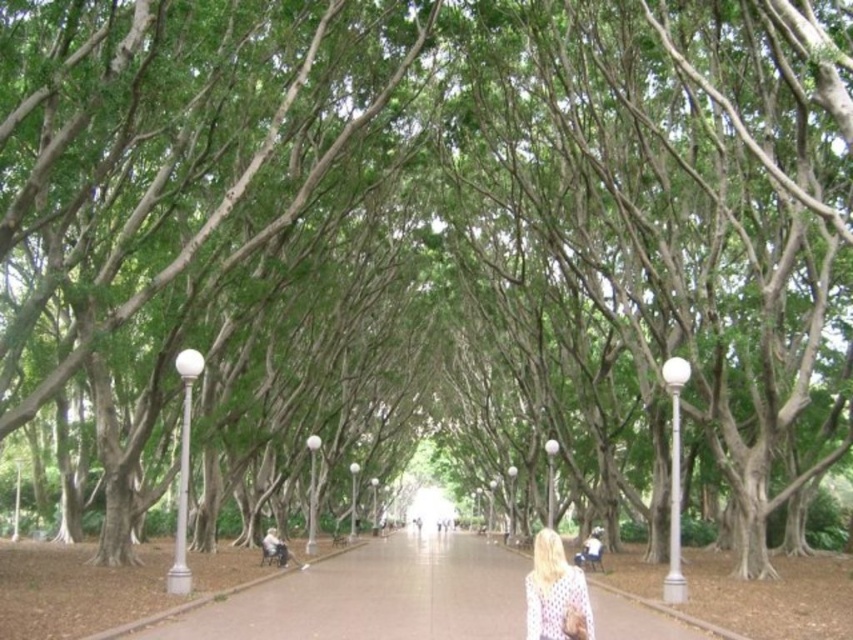
You are standing at the entrance of the pathway and want to walk to the end where the bright light is. The smooth concrete path at center is your only path. If your walking speed is 1.5 meters per second, how long will it take you to reach the end of the path?

The distance between you and the smooth concrete path at center is 11.21 meters. At a speed of 1.5 meters per second, it will take approximately 7.47 seconds to reach the end of the path.

You are standing on the smooth concrete path at center and want to place the white dotted sweater at center on a bench that is 1.5 meters tall. Can the sweater be placed on the bench without needing to lift it higher than its current position?

The smooth concrete path at center is taller than the white dotted sweater at center. Since the bench is 1.5 meters tall, the sweater can be placed on the bench without needing to lift it higher than its current position because the path is already elevated above the sweater.